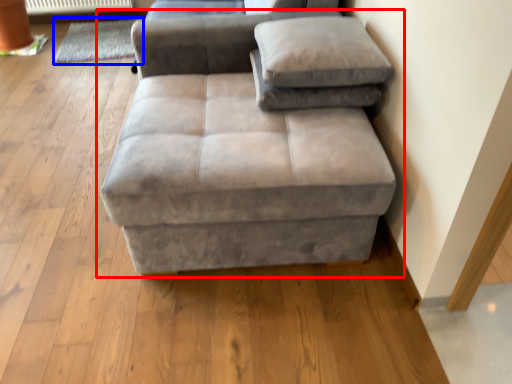
Question: Which object appears farthest to the camera in this image, studio couch (highlighted by a red box) or mat (highlighted by a blue box)?

Choices:
 (A) studio couch
 (B) mat

Answer: (B)